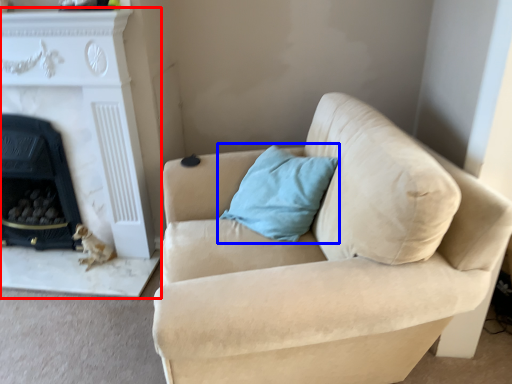
Question: Which object appears closest to the camera in this image, fireplace (highlighted by a red box) or pillow (highlighted by a blue box)?

Choices:
 (A) fireplace
 (B) pillow

Answer: (B)